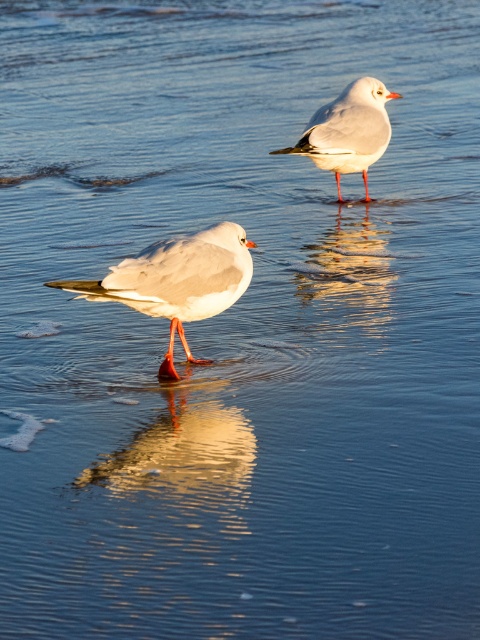
Question: Is white matte seagull at center thinner than white matte bird at upper center?

Choices:
 (A) no
 (B) yes

Answer: (A)

Question: Is white matte seagull at center wider than white matte bird at upper center?

Choices:
 (A) yes
 (B) no

Answer: (A)

Question: Which point is farther to the camera?

Choices:
 (A) white matte bird at upper center
 (B) white matte seagull at center

Answer: (A)

Question: Observing the image, what is the correct spatial positioning of white matte seagull at center in reference to white matte bird at upper center?

Choices:
 (A) above
 (B) below

Answer: (B)